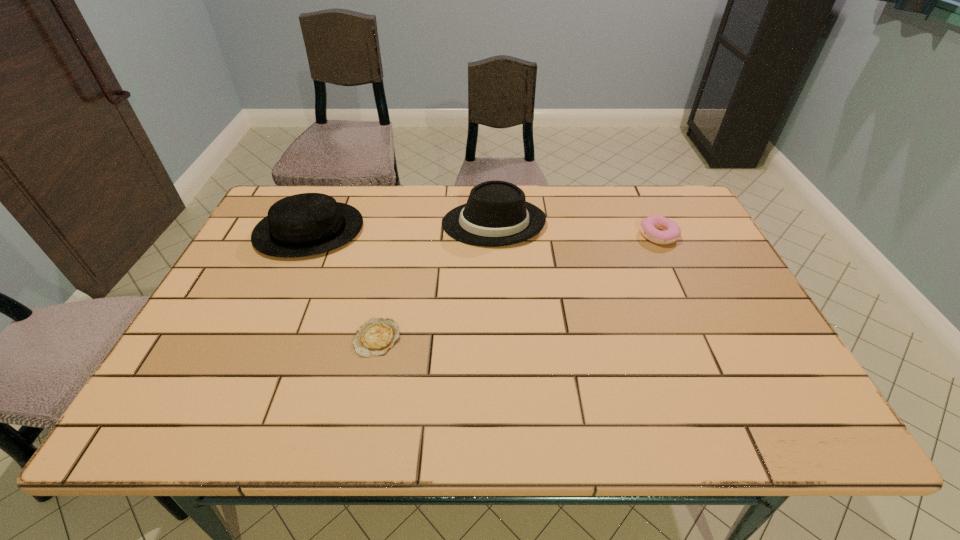
Find the location of a particular element. Image resolution: width=960 pixels, height=540 pixels. vacant area located 0.150m on the front-facing side of the tallest object is located at coordinates (393, 223).

Image resolution: width=960 pixels, height=540 pixels. I want to click on vacant space located 0.070m on the front of the leftmost object, so click(x=288, y=279).

The height and width of the screenshot is (540, 960). I want to click on vacant space located on the right of the rightmost object, so click(705, 235).

You are a GUI agent. You are given a task and a screenshot of the screen. Output one action in this format:
    pyautogui.click(x=<x>, y=<y>)
    Task: Click on the vacant area situated 0.150m on the back of the quiche
    The image size is (960, 540).
    Given the screenshot: What is the action you would take?
    pyautogui.click(x=391, y=277)

This screenshot has height=540, width=960. Find the location of `pastry that is at the far edge`. pastry that is at the far edge is located at coordinates (671, 232).

Locate an element on the screen. The width and height of the screenshot is (960, 540). object that is at the left edge is located at coordinates (306, 224).

The height and width of the screenshot is (540, 960). I want to click on object at the right edge, so click(671, 232).

You are a GUI agent. You are given a task and a screenshot of the screen. Output one action in this format:
    pyautogui.click(x=<x>, y=<y>)
    Task: Click on the object that is at the far left corner
    This screenshot has height=540, width=960.
    Given the screenshot: What is the action you would take?
    pyautogui.click(x=306, y=224)

Identify the location of object that is positioned at the far right corner. (671, 232).

In the image, there is a desktop. Identify the location of free space at the far edge. Image resolution: width=960 pixels, height=540 pixels. (550, 219).